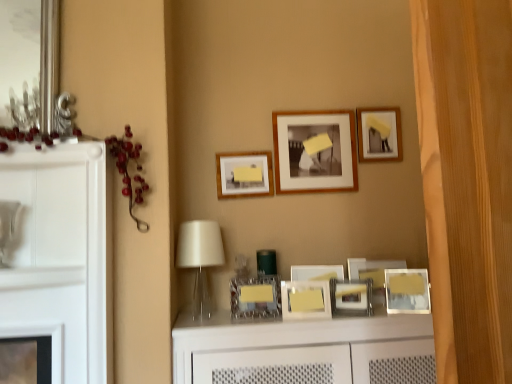
Question: Should I look upward or downward to see metallic silver picture frame at center, acting as the sixth picture frame starting from the top?

Choices:
 (A) up
 (B) down

Answer: (B)

Question: From the image's perspective, is wooden picture frame at upper right, acting as the first picture frame starting from the top, beneath metallic silver picture frame at center, the second picture frame ordered from the bottom?

Choices:
 (A) no
 (B) yes

Answer: (A)

Question: From the image's perspective, is wooden picture frame at upper right, placed as the 8th picture frame when sorted from bottom to top, above metallic silver picture frame at center, the second picture frame ordered from the bottom?

Choices:
 (A) yes
 (B) no

Answer: (A)

Question: Is wooden picture frame at upper right, acting as the first picture frame starting from the top, bigger than metallic silver picture frame at center, placed as the 7th picture frame when sorted from top to bottom?

Choices:
 (A) yes
 (B) no

Answer: (A)

Question: Is wooden picture frame at upper right, placed as the 8th picture frame when sorted from bottom to top, taller than metallic silver picture frame at center, the second picture frame ordered from the bottom?

Choices:
 (A) yes
 (B) no

Answer: (A)

Question: Is wooden picture frame at upper right, acting as the first picture frame starting from the top, surrounding metallic silver picture frame at center, the second picture frame ordered from the bottom?

Choices:
 (A) yes
 (B) no

Answer: (B)

Question: Considering the relative positions of wooden picture frame at upper right, acting as the first picture frame starting from the top, and metallic silver picture frame at center, the second picture frame ordered from the bottom, in the image provided, is wooden picture frame at upper right, acting as the first picture frame starting from the top, behind metallic silver picture frame at center, the second picture frame ordered from the bottom,?

Choices:
 (A) yes
 (B) no

Answer: (A)

Question: From the image's perspective, would you say white glossy vanity at center is shown under metallic silver picture frame at center, the eighth picture frame from the top?

Choices:
 (A) no
 (B) yes

Answer: (B)

Question: From the image's perspective, is white glossy vanity at center above metallic silver picture frame at center, the eighth picture frame from the top?

Choices:
 (A) yes
 (B) no

Answer: (B)

Question: Is white glossy vanity at center directly adjacent to metallic silver picture frame at center, the eighth picture frame from the top?

Choices:
 (A) no
 (B) yes

Answer: (A)

Question: Can you confirm if white glossy vanity at center is shorter than metallic silver picture frame at center, which is the 1th picture frame in bottom-to-top order?

Choices:
 (A) yes
 (B) no

Answer: (B)

Question: From a real-world perspective, is white glossy vanity at center physically below metallic silver picture frame at center, which is the 1th picture frame in bottom-to-top order?

Choices:
 (A) yes
 (B) no

Answer: (A)

Question: Is metallic silver picture frame at center, the eighth picture frame from the top, completely or partially inside white glossy vanity at center?

Choices:
 (A) no
 (B) yes

Answer: (A)

Question: Is translucent glass table lamp at center located within wooden picture frame at upper right, placed as the 8th picture frame when sorted from bottom to top?

Choices:
 (A) no
 (B) yes

Answer: (A)